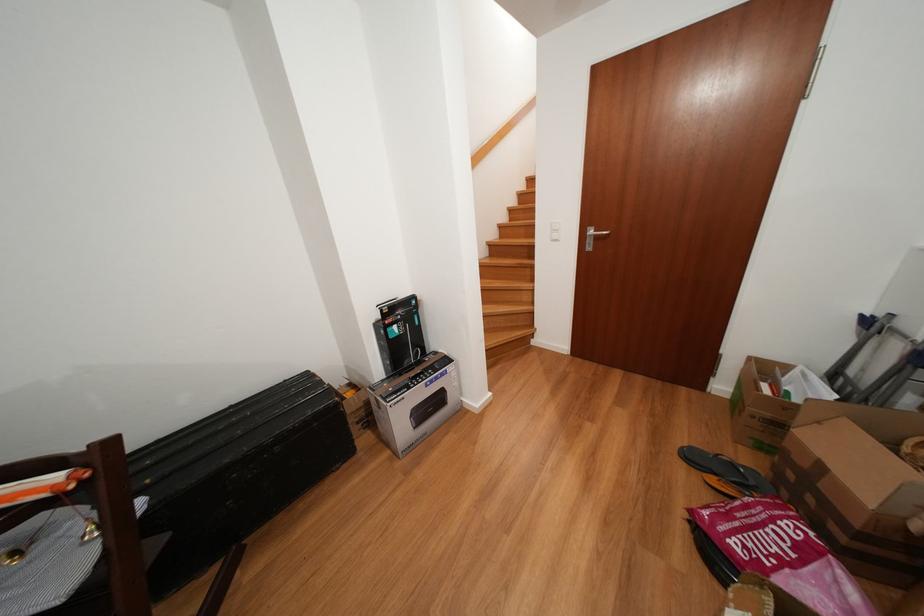
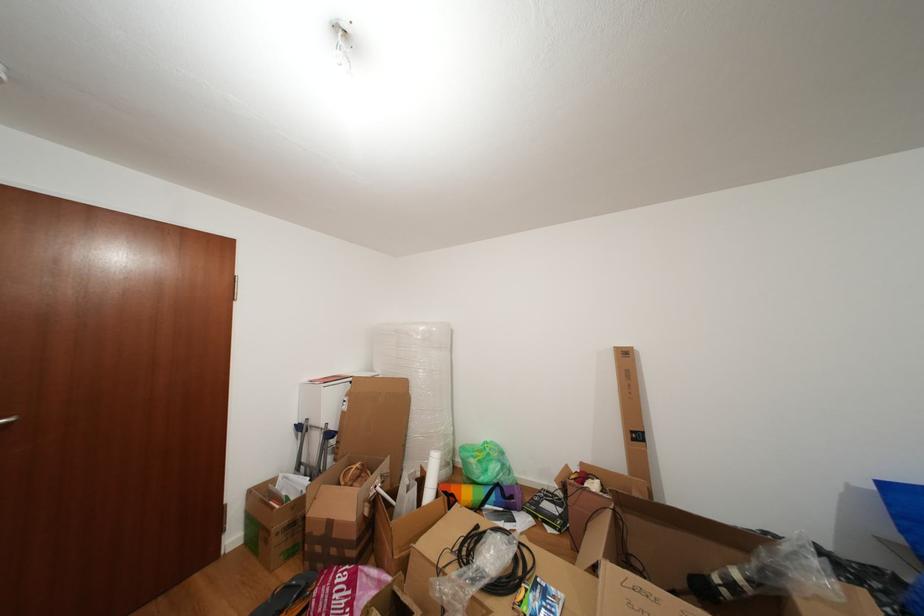
Locate, in the second image, the point that corresponds to the point at 758,363 in the first image.

(259, 496)